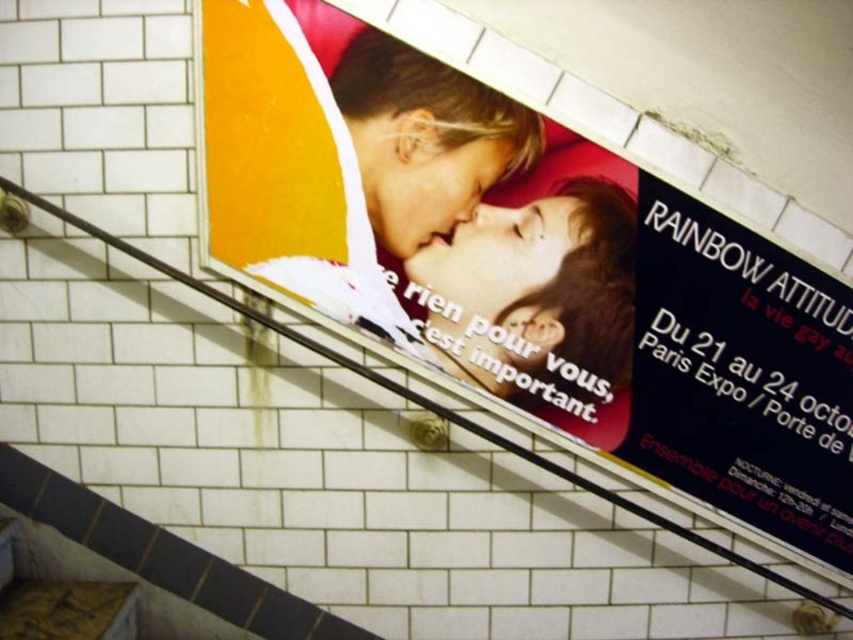
Question: In this image, where is matte plastic poster at center located relative to black glossy poster at upper right?

Choices:
 (A) right
 (B) left

Answer: (B)

Question: Is matte plastic poster at center positioned before black glossy poster at upper right?

Choices:
 (A) yes
 (B) no

Answer: (A)

Question: Is matte plastic poster at center further to camera compared to black glossy poster at upper right?

Choices:
 (A) yes
 (B) no

Answer: (B)

Question: Which object appears closest to the camera in this image?

Choices:
 (A) matte plastic poster at center
 (B) black glossy poster at upper right

Answer: (A)